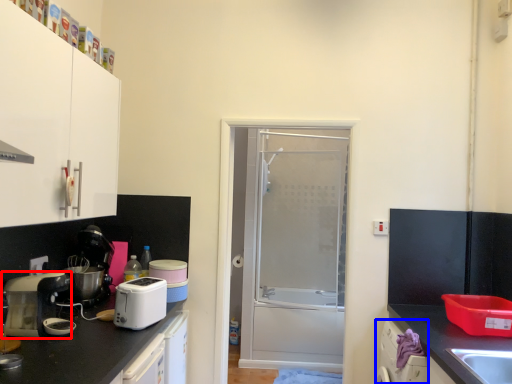
Question: Among these objects, which one is nearest to the camera, home appliance (highlighted by a red box) or dish washer (highlighted by a blue box)?

Choices:
 (A) home appliance
 (B) dish washer

Answer: (A)